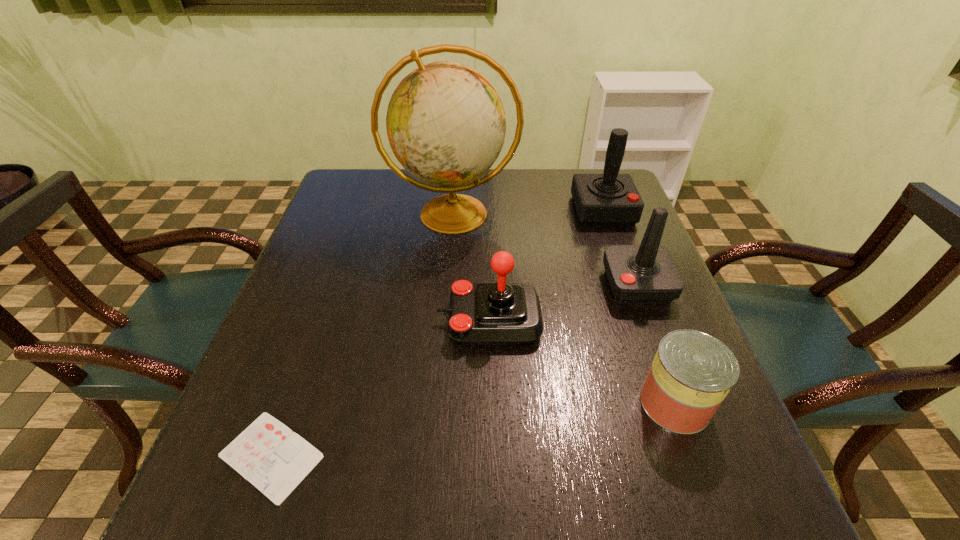
I want to click on vacant point at the near edge, so click(x=553, y=516).

In the image, there is a desktop. What are the coordinates of `vacant space at the left edge` in the screenshot? It's located at (333, 221).

I want to click on vacant position at the far right corner of the desktop, so click(x=575, y=174).

Identify the location of vacant point located between the globe and the can. The image size is (960, 540). pyautogui.click(x=564, y=308).

Where is `vacant area between the second shortest object and the diary`? The height and width of the screenshot is (540, 960). vacant area between the second shortest object and the diary is located at coordinates (473, 429).

Find the location of a particular element. This screenshot has height=540, width=960. free point between the diary and the farthest joystick is located at coordinates (437, 333).

Identify the location of free space between the fifth tallest object and the globe. (564, 308).

The height and width of the screenshot is (540, 960). Find the location of `vacant area that lies between the diary and the leftmost joystick`. vacant area that lies between the diary and the leftmost joystick is located at coordinates (380, 388).

At what (x,y) coordinates should I click in order to perform the action: click on vacant space that's between the can and the leftmost joystick. Please return your answer as a coordinate pair (x, y). This screenshot has width=960, height=540. Looking at the image, I should click on coord(582,361).

I want to click on vacant region between the tallest object and the leftmost joystick, so click(x=471, y=267).